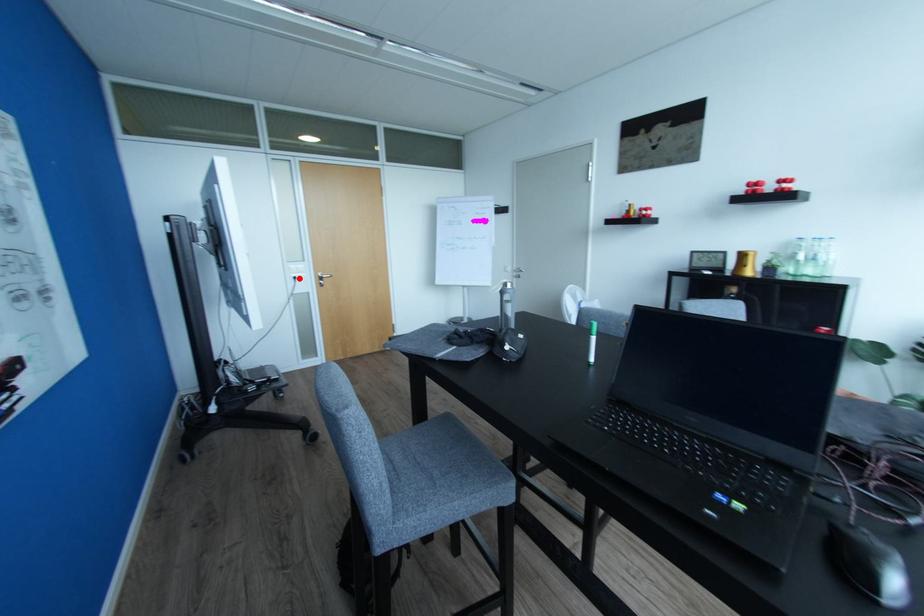
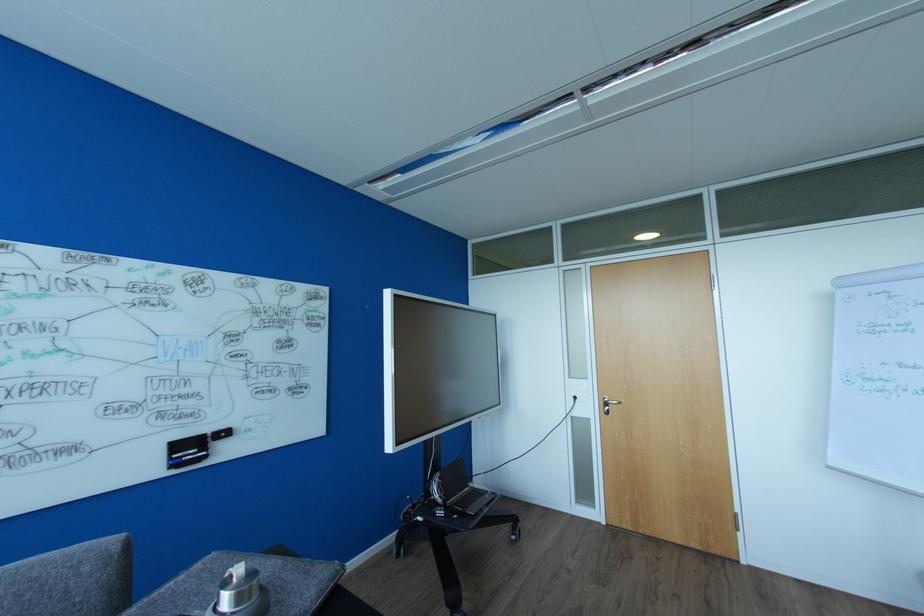
In the second image, find the point that corresponds to the highlighted location in the first image.

(578, 398)